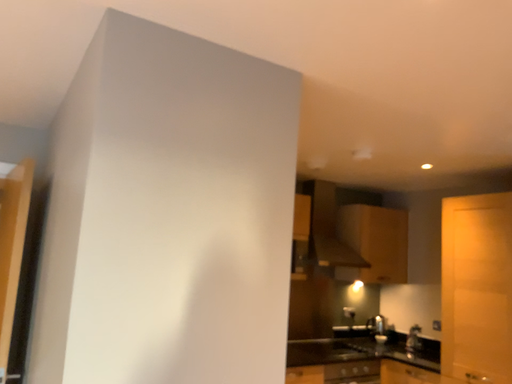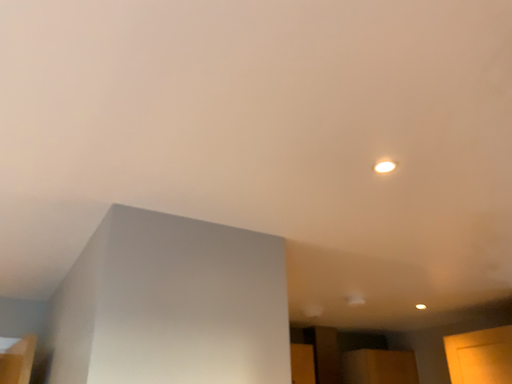
Question: Which way did the camera rotate in the video?

Choices:
 (A) rotated downward
 (B) rotated upward

Answer: (B)